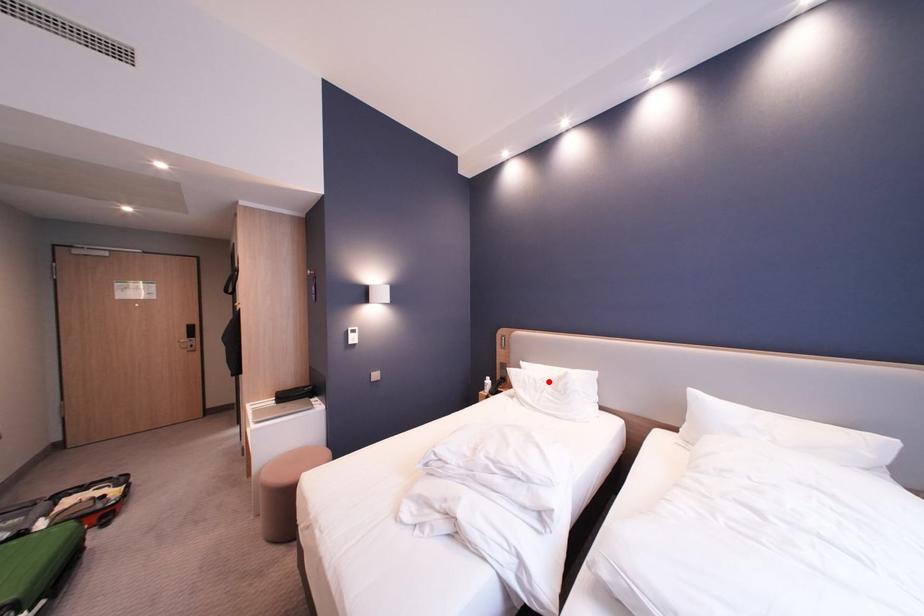
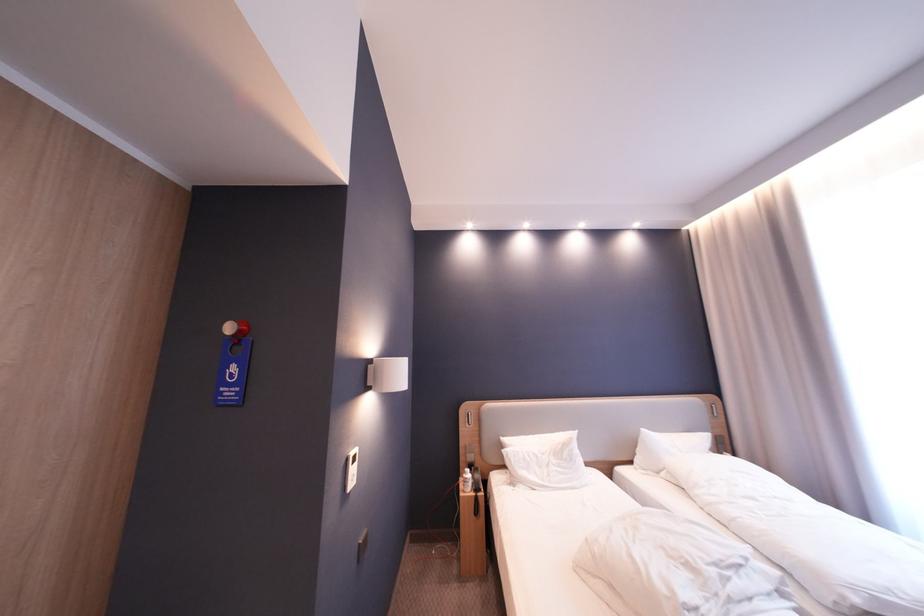
The point at the highlighted location is marked in the first image. Where is the corresponding point in the second image?

(550, 456)